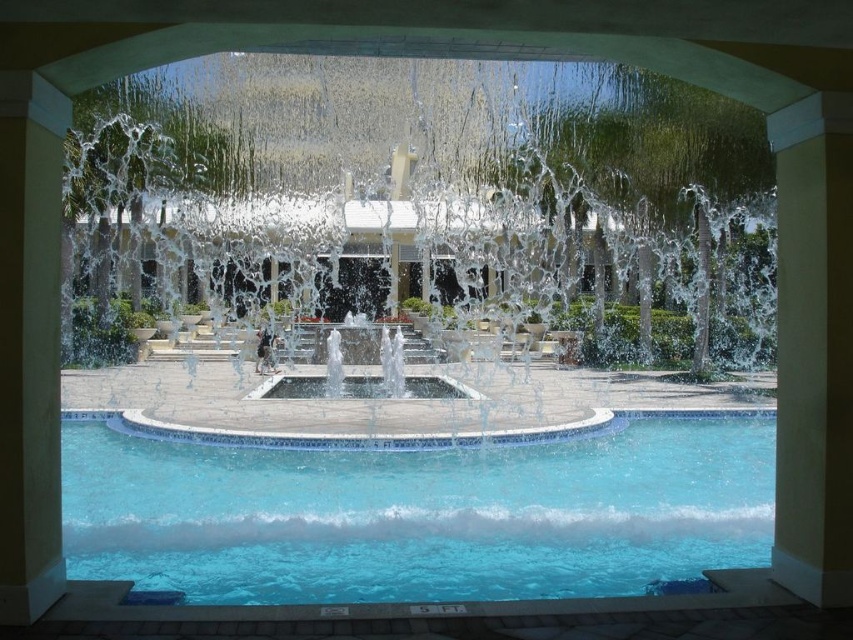
Question: Which object is positioned farthest from the clear glass fountain at center?

Choices:
 (A) clear glass water at center
 (B) clear glass swimming pool at lower center

Answer: (B)

Question: Does clear glass water at center have a larger size compared to clear glass fountain at center?

Choices:
 (A) no
 (B) yes

Answer: (B)

Question: Can you confirm if clear glass water at center is wider than yellow smooth pillar at left?

Choices:
 (A) no
 (B) yes

Answer: (B)

Question: Among these points, which one is nearest to the camera?

Choices:
 (A) (204, 534)
 (B) (25, 595)
 (C) (399, 385)

Answer: (B)

Question: Does clear glass water at center appear on the right side of clear glass fountain at center?

Choices:
 (A) no
 (B) yes

Answer: (B)

Question: Which point appears farthest from the camera in this image?

Choices:
 (A) (462, 560)
 (B) (252, 392)
 (C) (20, 317)
 (D) (366, 369)

Answer: (D)